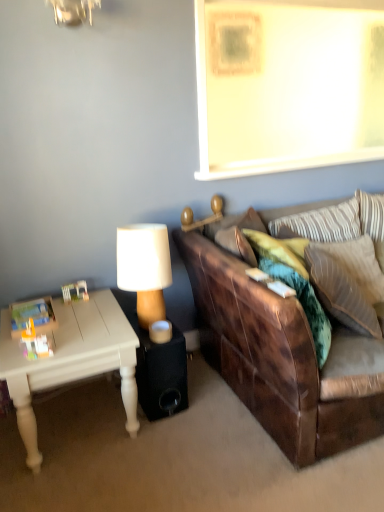
The width and height of the screenshot is (384, 512). Identify the location of vacant region to the right of black fabric speaker at lower center. (206, 398).